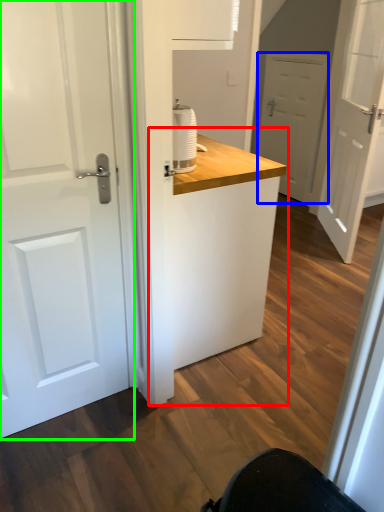
Question: Which object is the farthest from counter (highlighted by a red box)? Choose among these: door (highlighted by a blue box) or door (highlighted by a green box).

Choices:
 (A) door
 (B) door

Answer: (A)